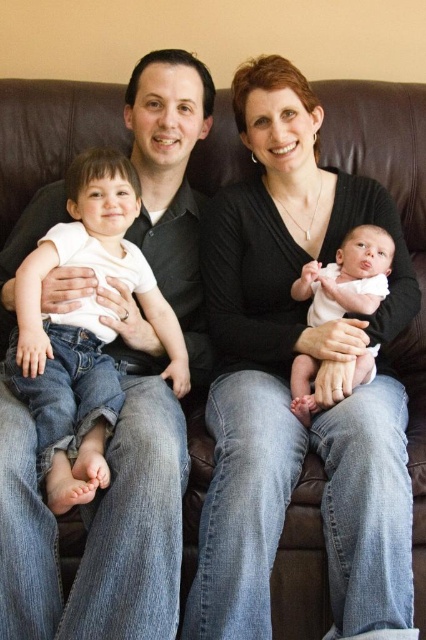
You are trying to decide which object is on the left between the black matte sweater at center and the matte black shirt at left. Based on the scene description, which one is positioned more to the left?

The matte black shirt at left is positioned more to the left than the black matte sweater at center.

You are a photographer trying to capture a closeup of the black matte sweater at center and the soft pink fabric baby at center. Which object should you focus on first if you want to ensure both are in focus without adjusting the camera settings?

The black matte sweater at center is taller than the soft pink fabric baby at center, so focusing on the black matte sweater at center first would ensure both are within the depth of field.